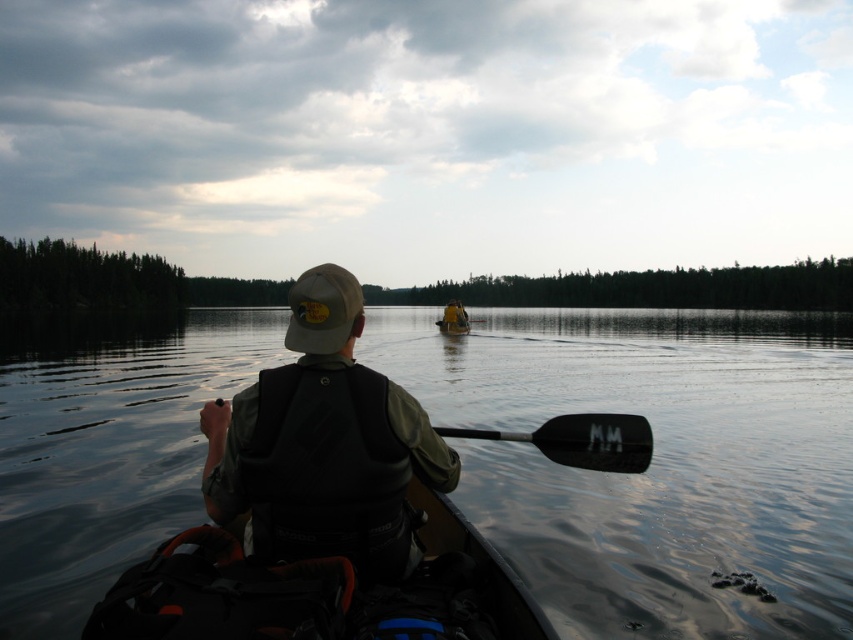
Which of these two, matte black life vest at center or yellow fabric boat at center, stands shorter?

With less height is yellow fabric boat at center.

Does matte black life vest at center have a larger size compared to yellow fabric boat at center?

Indeed, matte black life vest at center has a larger size compared to yellow fabric boat at center.

Does point (299, 508) come closer to viewer compared to point (463, 314)?

Yes, it is.

Identify the location of matte black life vest at center. This screenshot has width=853, height=640. (323, 444).

Is black smooth paddle at lower center further to camera compared to yellow fabric boat at center?

No, it is not.

Which is behind, point (622, 444) or point (465, 316)?

The point (465, 316) is more distant.

You are a GUI agent. You are given a task and a screenshot of the screen. Output one action in this format:
    pyautogui.click(x=<x>, y=<y>)
    Task: Click on the black smooth paddle at lower center
    
    Given the screenshot: What is the action you would take?
    pyautogui.click(x=581, y=440)

Does yellow plastic canoe at center have a greater width compared to matte black kayak at center?

Indeed, yellow plastic canoe at center has a greater width compared to matte black kayak at center.

The width and height of the screenshot is (853, 640). What do you see at coordinates (453, 324) in the screenshot?
I see `yellow plastic canoe at center` at bounding box center [453, 324].

Between point (467, 324) and point (450, 308), which one is positioned behind?

Positioned behind is point (467, 324).

You are a GUI agent. You are given a task and a screenshot of the screen. Output one action in this format:
    pyautogui.click(x=<x>, y=<y>)
    Task: Click on the yellow plastic canoe at center
    The width and height of the screenshot is (853, 640).
    Given the screenshot: What is the action you would take?
    pyautogui.click(x=453, y=324)